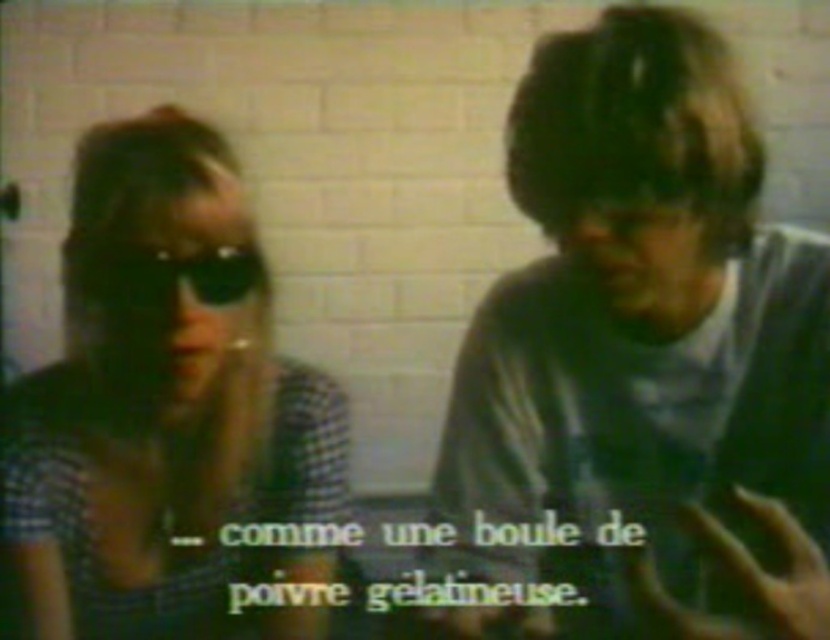
You are a photographer trying to capture a closeup shot of both the matte gray shirt at center and the checkered fabric shirt at left. The camera you are using has a maximum focus range of 25 centimeters. Can you fit both shirts within the camera frame without moving the camera?

The matte gray shirt at center and checkered fabric shirt at left are 26.31 centimeters apart from each other. Since the camera can only focus within 25 centimeters, the distance between them exceeds the maximum focus range. Therefore, you cannot fit both shirts within the camera frame without moving the camera.